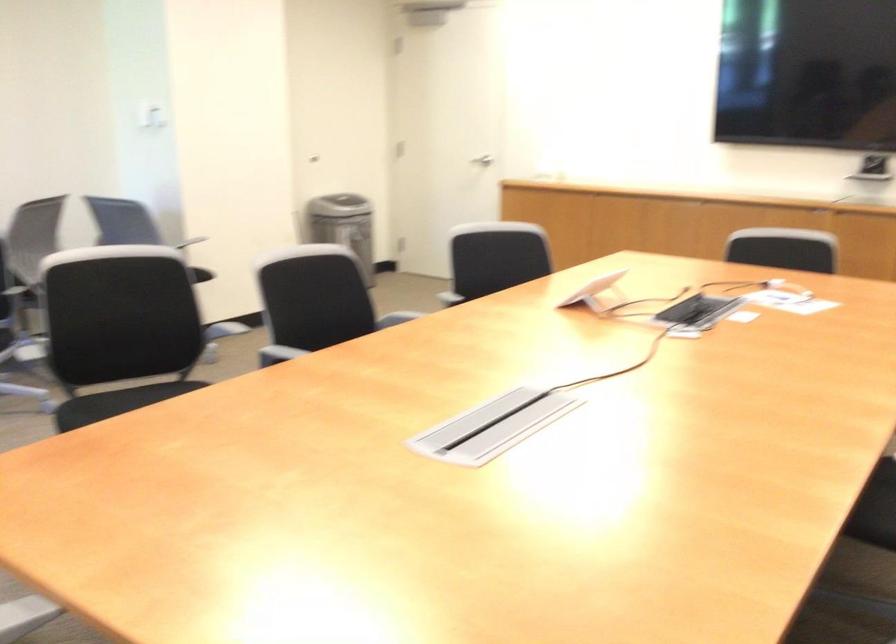
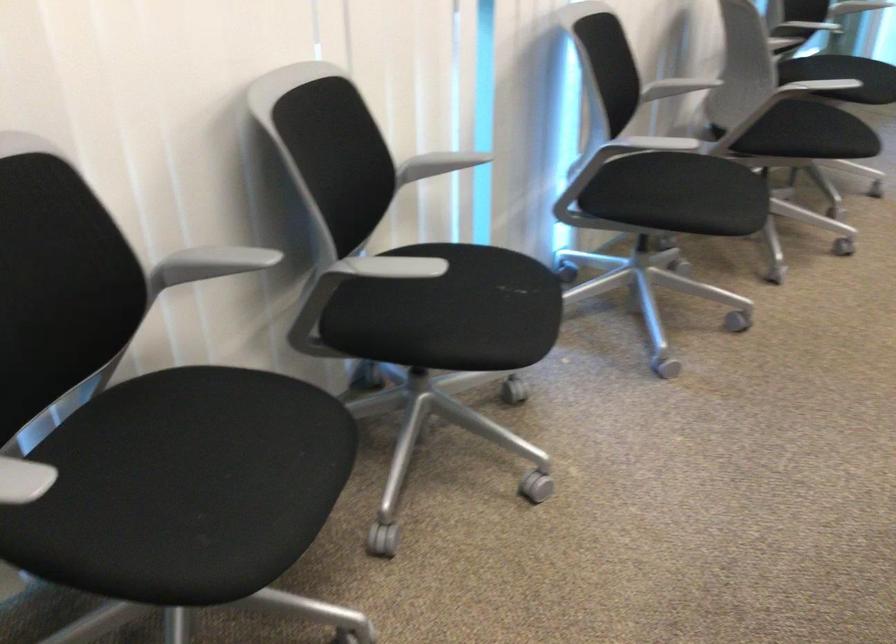
The images are taken continuously from a first-person perspective. In which direction is your viewpoint rotating?

The rotation direction of the camera is left-down.